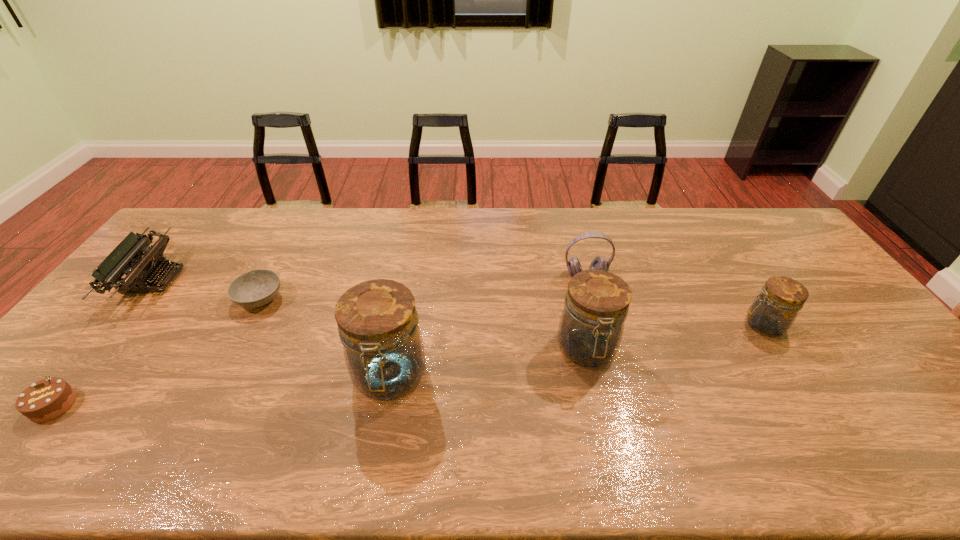
Identify the location of vacant region that satisfies the following two spatial constraints: 1. on the typing side of the typewriter; 2. on the back side of the bowl. This screenshot has height=540, width=960. (137, 299).

Where is `vacant space that satisfies the following two spatial constraints: 1. on the lid of the rightmost jar; 2. on the lid of the leftmost jar`? vacant space that satisfies the following two spatial constraints: 1. on the lid of the rightmost jar; 2. on the lid of the leftmost jar is located at coordinates (796, 377).